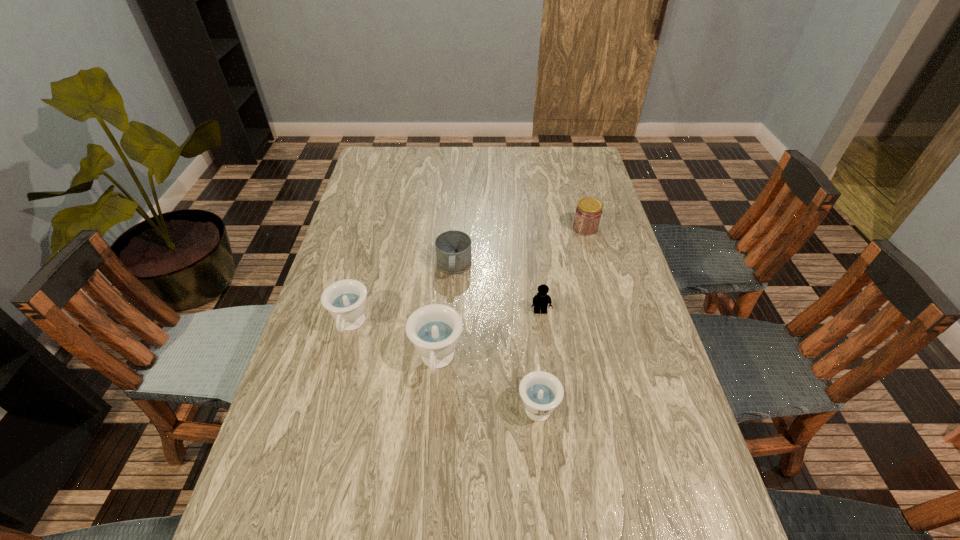
Where is `unoccupied position between the leftmost teacup and the mug`? Image resolution: width=960 pixels, height=540 pixels. unoccupied position between the leftmost teacup and the mug is located at coordinates (402, 296).

In order to click on vacant space in between the second farthest object and the Lego in this screenshot , I will do `click(497, 289)`.

This screenshot has width=960, height=540. I want to click on the second closest object to the fifth nearest object, so click(x=434, y=329).

Identify which object is located as the third nearest to the second teacup from right to left. Please provide its 2D coordinates. Your answer should be formatted as a tuple, i.e. [(x, y)], where the tuple contains the x and y coordinates of a point satisfying the conditions above.

[(453, 248)]

Locate an element on the screen. Image resolution: width=960 pixels, height=540 pixels. teacup object that ranks as the second closest to the farthest object is located at coordinates (541, 392).

Locate which teacup ranks second in proximity to the mug. Please provide its 2D coordinates. Your answer should be formatted as a tuple, i.e. [(x, y)], where the tuple contains the x and y coordinates of a point satisfying the conditions above.

[(434, 329)]